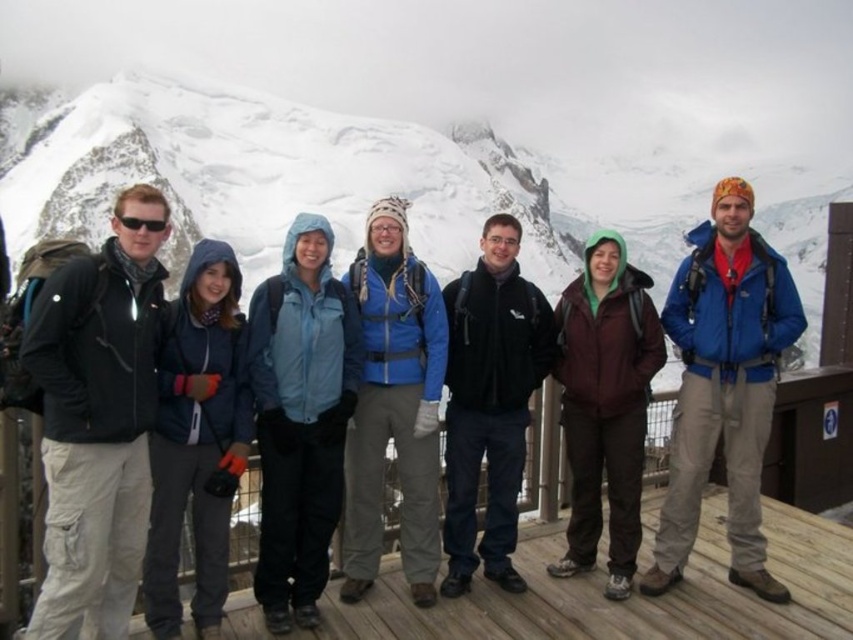
Question: Which is nearer to the blue fleece jacket at center?

Choices:
 (A) matte black jacket at left
 (B) wooden deck at center
 (C) black fleece jacket at center

Answer: (B)

Question: Which of the following is the farthest from the observer?

Choices:
 (A) (341, 177)
 (B) (706, 579)
 (C) (758, 396)

Answer: (A)

Question: Can you confirm if wooden deck at center is positioned below blue fleece jacket at center?

Choices:
 (A) no
 (B) yes

Answer: (B)

Question: Can you confirm if matte black jacket at left is bigger than black fleece jacket at center?

Choices:
 (A) yes
 (B) no

Answer: (B)

Question: Can you confirm if snowy mountain at upper center is positioned above blue fleece jacket at center?

Choices:
 (A) yes
 (B) no

Answer: (A)

Question: Which of the following is the closest to the observer?

Choices:
 (A) (50, 458)
 (B) (503, 625)
 (C) (236, 108)
 (D) (521, 577)

Answer: (A)